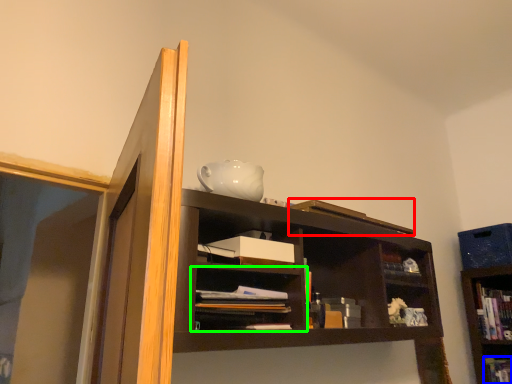
Question: Considering the real-world distances, which object is farthest from book (highlighted by a red box)? book (highlighted by a blue box) or shelf (highlighted by a green box)?

Choices:
 (A) book
 (B) shelf

Answer: (A)